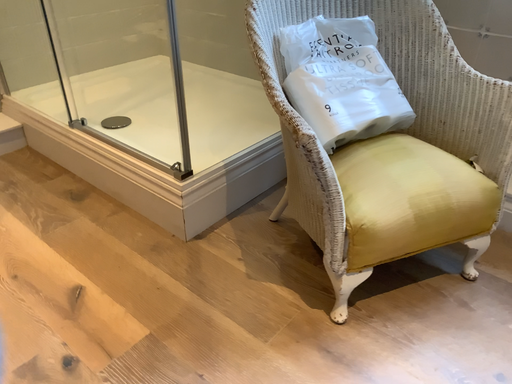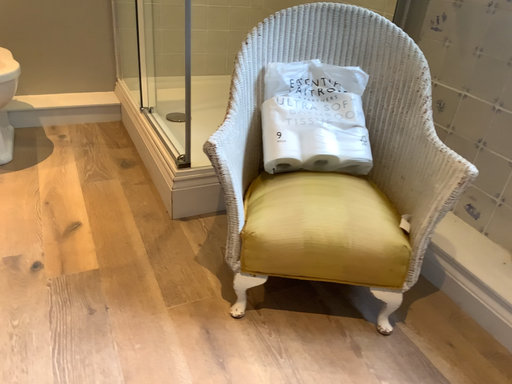
Question: Which way did the camera rotate in the video?

Choices:
 (A) rotated right
 (B) rotated left

Answer: (B)